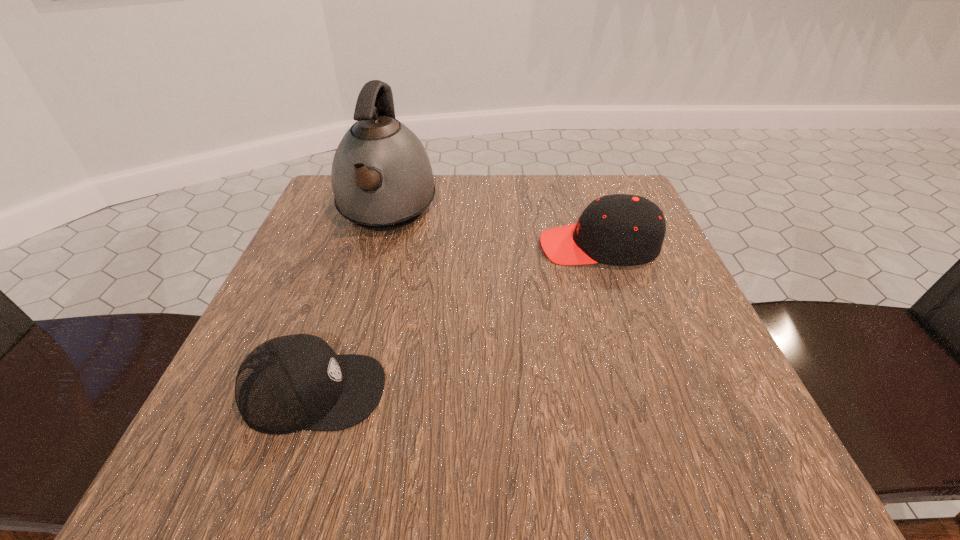
You are a GUI agent. You are given a task and a screenshot of the screen. Output one action in this format:
    pyautogui.click(x=<x>, y=<y>)
    Task: Click on the vacant area that lies between the kettle and the taller cap
    
    Given the screenshot: What is the action you would take?
    pyautogui.click(x=492, y=230)

At what (x,y) coordinates should I click in order to perform the action: click on vacant region between the kettle and the second shortest object. Please return your answer as a coordinate pair (x, y). Looking at the image, I should click on (492, 230).

I want to click on vacant area between the nearer cap and the kettle, so click(350, 302).

Identify the location of empty location between the shortest object and the second shortest object. (456, 319).

Locate an element on the screen. This screenshot has height=540, width=960. free space between the tallest object and the rightmost object is located at coordinates (492, 230).

This screenshot has height=540, width=960. Find the location of `free space that is in between the rightmost object and the kettle`. free space that is in between the rightmost object and the kettle is located at coordinates (492, 230).

The width and height of the screenshot is (960, 540). Identify the location of blank region between the taller cap and the left cap. (456, 319).

Image resolution: width=960 pixels, height=540 pixels. What are the coordinates of `object that stands as the closest to the rightmost object` in the screenshot? It's located at (382, 179).

Select which object appears as the second closest to the shorter cap. Please provide its 2D coordinates. Your answer should be formatted as a tuple, i.e. [(x, y)], where the tuple contains the x and y coordinates of a point satisfying the conditions above.

[(620, 229)]

At what (x,y) coordinates should I click in order to perform the action: click on blank area in the image that satisfies the following two spatial constraints: 1. at the spout of the tallest object; 2. on the front-facing side of the nearest object. Please return your answer as a coordinate pair (x, y). Looking at the image, I should click on (334, 392).